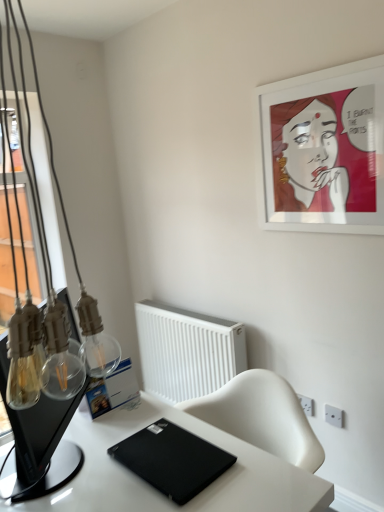
Question: Could you tell me if white matte picture frame at upper right is facing white glossy desk at center?

Choices:
 (A) no
 (B) yes

Answer: (A)

Question: Is white matte picture frame at upper right further to camera compared to white glossy desk at center?

Choices:
 (A) no
 (B) yes

Answer: (B)

Question: Can you confirm if white matte picture frame at upper right is shorter than white glossy desk at center?

Choices:
 (A) yes
 (B) no

Answer: (A)

Question: Is white matte picture frame at upper right closer to camera compared to white glossy desk at center?

Choices:
 (A) no
 (B) yes

Answer: (A)

Question: Is white glossy desk at center located within white matte picture frame at upper right?

Choices:
 (A) yes
 (B) no

Answer: (B)

Question: In terms of width, does white matte picture frame at upper right look wider or thinner when compared to transparent glass monitor at left?

Choices:
 (A) wide
 (B) thin

Answer: (B)

Question: Is white matte picture frame at upper right situated inside transparent glass monitor at left or outside?

Choices:
 (A) outside
 (B) inside

Answer: (A)

Question: Relative to transparent glass monitor at left, is white matte picture frame at upper right in front or behind?

Choices:
 (A) front
 (B) behind

Answer: (B)

Question: Based on their positions, is white matte picture frame at upper right located to the left or right of transparent glass monitor at left?

Choices:
 (A) right
 (B) left

Answer: (A)

Question: Choose the correct answer: Is white glossy desk at center inside black matte laptop at lower center or outside it?

Choices:
 (A) inside
 (B) outside

Answer: (B)

Question: Is white glossy desk at center wider or thinner than black matte laptop at lower center?

Choices:
 (A) thin
 (B) wide

Answer: (B)

Question: Would you say white glossy desk at center is to the left or to the right of black matte laptop at lower center in the picture?

Choices:
 (A) left
 (B) right

Answer: (B)

Question: In terms of height, does white glossy desk at center look taller or shorter compared to black matte laptop at lower center?

Choices:
 (A) tall
 (B) short

Answer: (A)

Question: From a real-world perspective, is white plastic radiator at center above or below white matte picture frame at upper right?

Choices:
 (A) below
 (B) above

Answer: (A)

Question: Is white plastic radiator at center wider or thinner than white matte picture frame at upper right?

Choices:
 (A) wide
 (B) thin

Answer: (A)